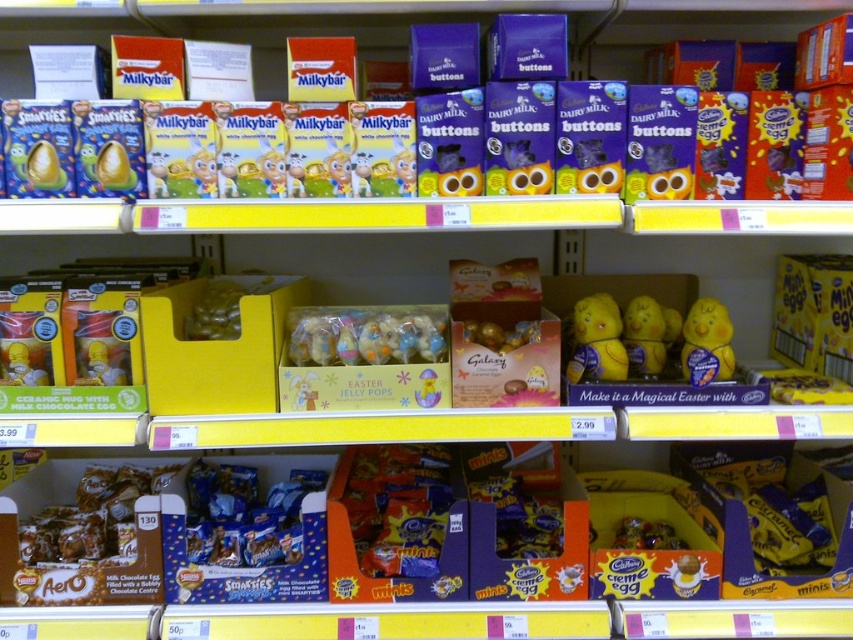
You are a supermarket employee who needs to place a new product between the translucent yellow jelly beans at center and the shiny gold foil wrapped chocolate at center on the top shelf. The new product requires 10 inches of space. Is there enough space between them?

The distance between the translucent yellow jelly beans at center and the shiny gold foil wrapped chocolate at center is 17.14 inches. Since the new product requires 10 inches of space, there is sufficient space between them to accommodate it.

You are a customer looking at the supermarket shelf and want to grab the pastel candy at center and the shiny gold foil wrapped chocolate at center. Which one do you need to reach for first?

The pastel candy at center is closer to the viewer than the shiny gold foil wrapped chocolate at center, so you should reach for the pastel candy at center first.